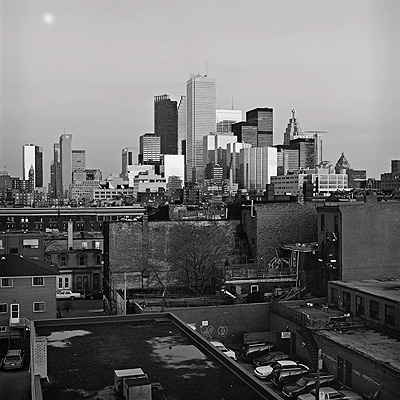
Identify the location of stairs down from doorway. The width and height of the screenshot is (400, 400). (26, 324).